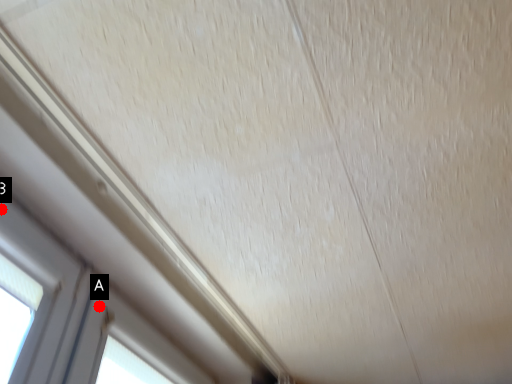
Question: Two points are circled on the image, labeled by A and B beside each circle. Which point is farther to the camera?

Choices:
 (A) A is further
 (B) B is further

Answer: (A)